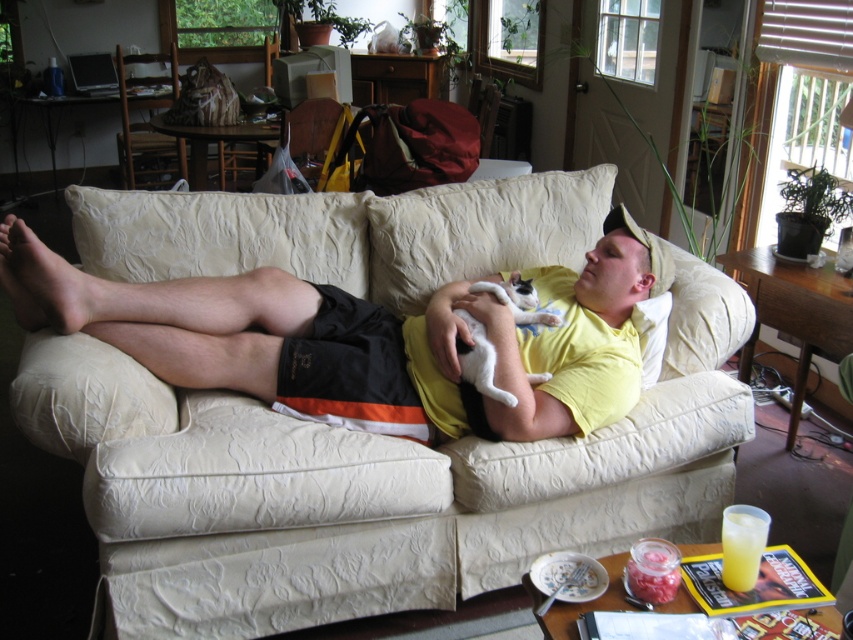
Is point (102, 326) closer to viewer compared to point (495, 284)?

Yes, it is in front of point (495, 284).

Is yellow cotton shirt at center above white fur cat at center?

Yes.

Which is behind, point (62, 305) or point (531, 289)?

Positioned behind is point (531, 289).

The image size is (853, 640). Identify the location of yellow cotton shirt at center. (164, 316).

Does yellow cotton shirt at center appear on the right side of yellow translucent cup at lower right?

No, yellow cotton shirt at center is not to the right of yellow translucent cup at lower right.

Is point (183, 308) closer to camera compared to point (755, 518)?

No, it is behind (755, 518).

Is point (642, 246) closer to camera compared to point (761, 518)?

No, (642, 246) is further to viewer.

This screenshot has height=640, width=853. I want to click on yellow cotton shirt at center, so click(164, 316).

Is beige fabric couch at center thinner than yellow translucent cup at lower right?

No, beige fabric couch at center is not thinner than yellow translucent cup at lower right.

Which is behind, point (207, 216) or point (722, 531)?

Point (207, 216)

Identify the location of beige fabric couch at center. (368, 484).